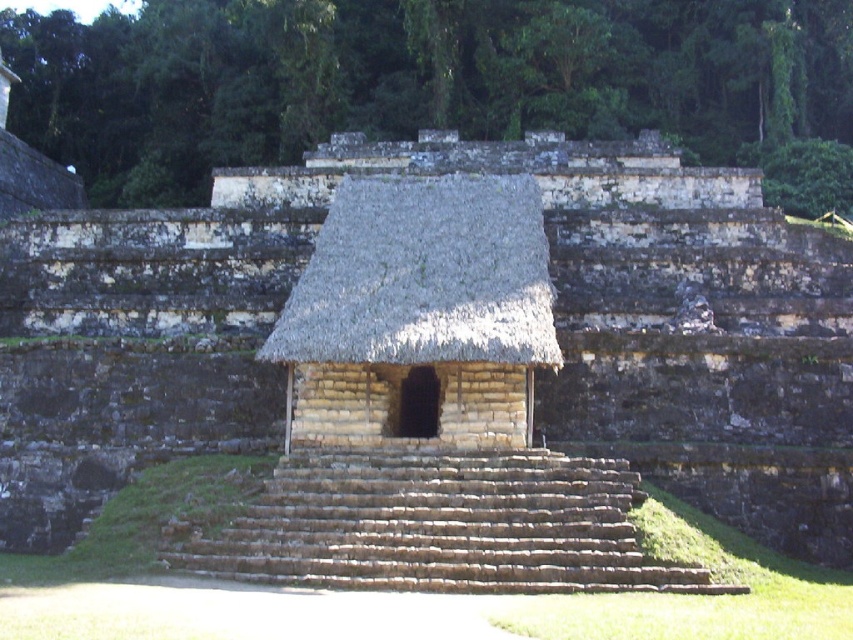
You are an archaeologist planning to excavate the stone amphitheater at center and the brown stone stairs at center. Which structure requires a larger excavation area based on their widths?

The stone amphitheater at center might be wider than brown stone stairs at center, so it likely requires a larger excavation area.

You are standing at the base of the staircase leading to the ancient building and want to reach the entrance. Which point, point(x=413, y=339) or point(x=631, y=506), is closer to you as you approach the structure?

Point(x=413, y=339) is closer to you because it is further to the viewer than point(x=631, y=506), meaning it is physically nearer in the scene.